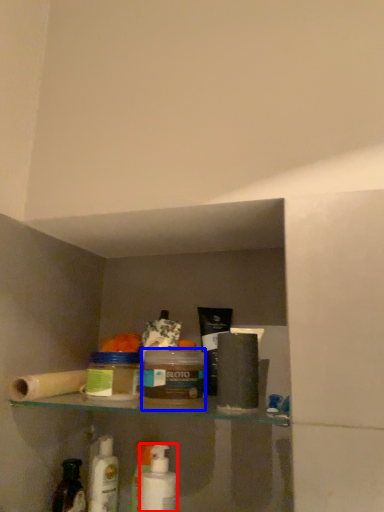
Question: Among these objects, which one is farthest to the camera, mouthwash (highlighted by a red box) or product (highlighted by a blue box)?

Choices:
 (A) mouthwash
 (B) product

Answer: (A)